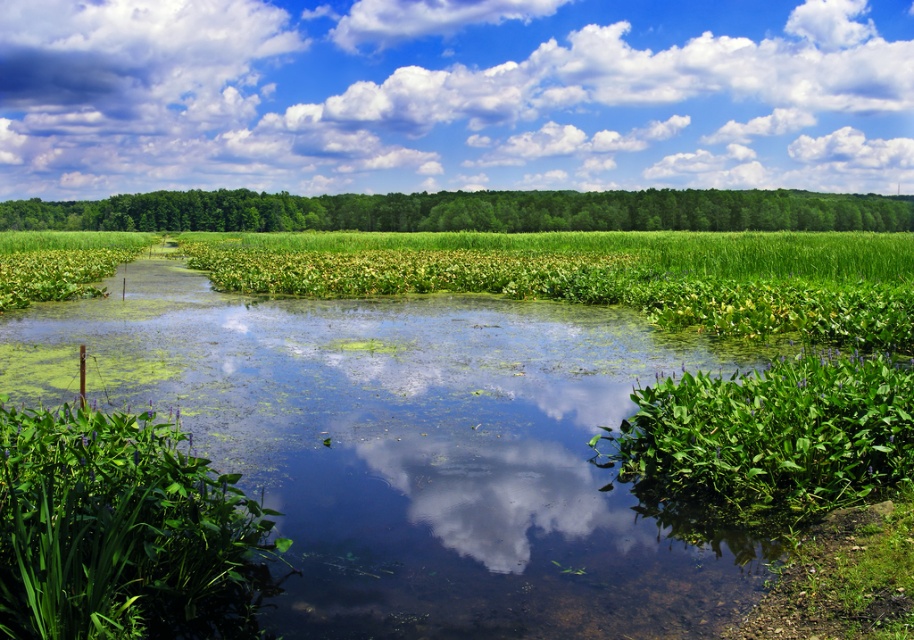
Question: Is white fluffy cloud at upper center above green leafy plants at center?

Choices:
 (A) yes
 (B) no

Answer: (A)

Question: Is white fluffy cloud at upper center wider than green leafy plants at center?

Choices:
 (A) no
 (B) yes

Answer: (B)

Question: Which point appears farthest from the camera in this image?

Choices:
 (A) (392, 221)
 (B) (323, 42)

Answer: (B)

Question: Among these points, which one is farthest from the camera?

Choices:
 (A) (619, 40)
 (B) (858, 227)

Answer: (A)

Question: Is white fluffy cloud at upper center below green leafy plants at center?

Choices:
 (A) no
 (B) yes

Answer: (A)